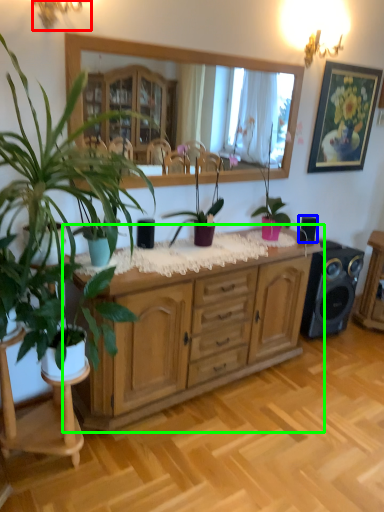
Question: Which object is the farthest from lamp (highlighted by a red box)? Choose among these: speaker (highlighted by a blue box) or cabinetry (highlighted by a green box).

Choices:
 (A) speaker
 (B) cabinetry

Answer: (A)